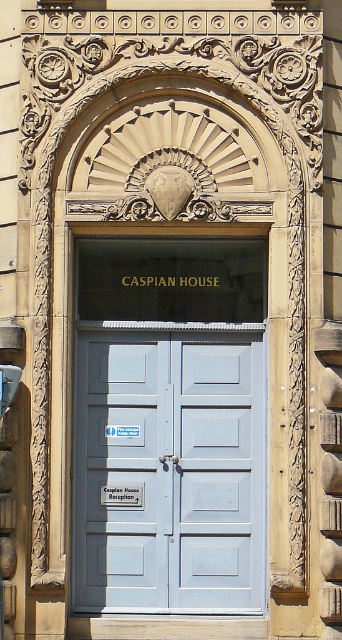
You are standing in front of the Caspian House entrance and want to read the street sign. Can you see the white plastic street sign at center through the light blue wood door at center?

The white plastic street sign at center is behind the light blue wood door at center, so you cannot see the white plastic street sign at center through the light blue wood door at center.

You are standing in front of the Caspian House entrance and need to locate the light blue wood door at center. According to the coordinates provided, where exactly would you find it?

The light blue wood door at center is located at the coordinates point (168, 470).

You are standing at point (168,470) in the image of Caspian House entrance. What object is located exactly at this point?

The light blue wood door at center is located exactly at point (168,470).